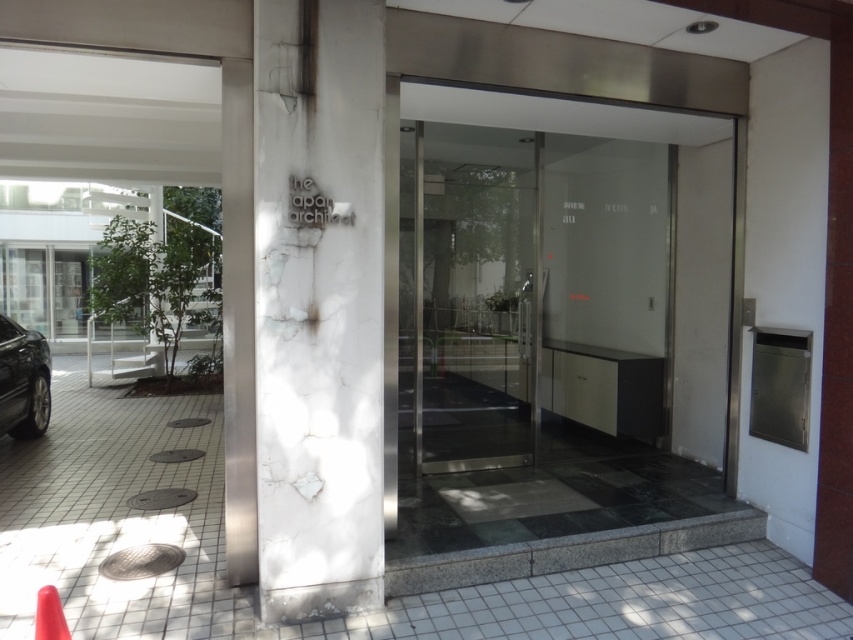
You are a maintenance worker who needs to reach the top of the transparent glass elevator at center and the white marble pillar at center. Which one will require you to climb higher?

The white marble pillar at center requires climbing higher because it is taller than the transparent glass elevator at center.

You are standing at the entrance of the building and want to take the transparent glass elevator at center to the second floor. Which direction should you walk to reach it?

The transparent glass elevator at center is located at point (556, 316), so you should walk straight ahead from the entrance to reach it.